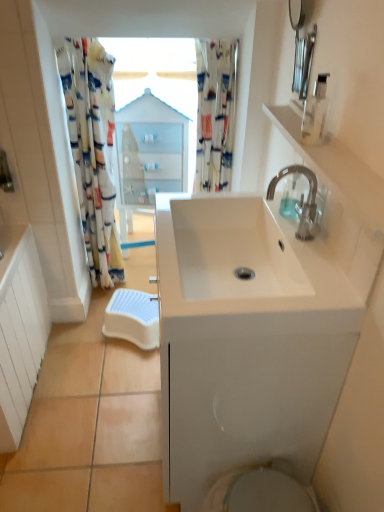
Locate an element on the screen. transparent plastic soap dispenser at upper right, arranged as the 2th soap dispenser when ordered from the bottom is located at coordinates (315, 112).

Find the location of a particular element. silver metallic faucet at upper right is located at coordinates (301, 200).

Measure the distance between point (231,106) and camera.

A distance of 5.96 feet exists between point (231,106) and camera.

The image size is (384, 512). Describe the element at coordinates (248, 268) in the screenshot. I see `white glossy sink at center` at that location.

Where is `floral fabric shower curtain at left, which appears as the second shower curtain when viewed from the right`? The height and width of the screenshot is (512, 384). floral fabric shower curtain at left, which appears as the second shower curtain when viewed from the right is located at coordinates (93, 150).

Image resolution: width=384 pixels, height=512 pixels. What do you see at coordinates (151, 152) in the screenshot?
I see `white glossy cabinet at center` at bounding box center [151, 152].

The width and height of the screenshot is (384, 512). Find the location of `white glossy cabinet at center`. white glossy cabinet at center is located at coordinates (151, 152).

Find the location of a particular element. This screenshot has height=512, width=384. transparent plastic soap dispenser at upper right, arranged as the 2th soap dispenser when ordered from the bottom is located at coordinates (315, 112).

What's the angular difference between white plastic step stool at lower center and clear plastic soap dispenser at upper right, marked as the 1th soap dispenser in a back-to-front arrangement,'s facing directions?

white plastic step stool at lower center and clear plastic soap dispenser at upper right, marked as the 1th soap dispenser in a back-to-front arrangement, are facing 61.8 degrees away from each other.

From the image's perspective, between white plastic step stool at lower center and clear plastic soap dispenser at upper right, positioned as the 1th soap dispenser in bottom-to-top order, who is located below?

white plastic step stool at lower center.

Who is smaller, white plastic step stool at lower center or clear plastic soap dispenser at upper right, marked as the 1th soap dispenser in a back-to-front arrangement?

With smaller size is clear plastic soap dispenser at upper right, marked as the 1th soap dispenser in a back-to-front arrangement.

Looking at this image, is white glossy cabinet at center positioned beyond the bounds of clear plastic soap dispenser at upper right, positioned as the 1th soap dispenser in bottom-to-top order?

white glossy cabinet at center is positioned outside clear plastic soap dispenser at upper right, positioned as the 1th soap dispenser in bottom-to-top order.

Is point (127, 123) positioned after point (284, 189)?

Yes, point (127, 123) is behind point (284, 189).

In the image, is white glossy cabinet at center on the left side or the right side of clear plastic soap dispenser at upper right, marked as the 1th soap dispenser in a back-to-front arrangement?

Clearly, white glossy cabinet at center is on the left of clear plastic soap dispenser at upper right, marked as the 1th soap dispenser in a back-to-front arrangement, in the image.

Image resolution: width=384 pixels, height=512 pixels. I want to click on soap dispenser that appears below the floral fabric shower curtain at left, which appears as the second shower curtain when viewed from the right (from the image's perspective), so click(290, 198).

From the image's perspective, between clear plastic soap dispenser at upper right, the second soap dispenser when ordered from front to back, and floral fabric shower curtain at left, which appears as the second shower curtain when viewed from the right, who is located below?

clear plastic soap dispenser at upper right, the second soap dispenser when ordered from front to back, is shown below in the image.

Are clear plastic soap dispenser at upper right, the second soap dispenser when ordered from front to back, and floral fabric shower curtain at left, which appears as the 1th shower curtain when viewed from the left, far apart?

Yes.

From a real-world perspective, is silver metallic faucet at upper right above or below clear plastic soap dispenser at upper right, positioned as the 1th soap dispenser in bottom-to-top order?

silver metallic faucet at upper right is situated higher than clear plastic soap dispenser at upper right, positioned as the 1th soap dispenser in bottom-to-top order, in the real world.

How many degrees apart are the facing directions of silver metallic faucet at upper right and clear plastic soap dispenser at upper right, marked as the 1th soap dispenser in a back-to-front arrangement?

There is a 0.00917-degree angle between the facing directions of silver metallic faucet at upper right and clear plastic soap dispenser at upper right, marked as the 1th soap dispenser in a back-to-front arrangement.

Considering the relative sizes of silver metallic faucet at upper right and clear plastic soap dispenser at upper right, marked as the 1th soap dispenser in a back-to-front arrangement, in the image provided, is silver metallic faucet at upper right shorter than clear plastic soap dispenser at upper right, marked as the 1th soap dispenser in a back-to-front arrangement,?

No, silver metallic faucet at upper right is not shorter than clear plastic soap dispenser at upper right, marked as the 1th soap dispenser in a back-to-front arrangement.

Is silver metallic faucet at upper right bigger or smaller than clear plastic soap dispenser at upper right, positioned as the 1th soap dispenser in bottom-to-top order?

Clearly, silver metallic faucet at upper right is larger in size than clear plastic soap dispenser at upper right, positioned as the 1th soap dispenser in bottom-to-top order.

Between white glossy sink at center and silver metallic faucet at upper right, which one has more height?

Standing taller between the two is silver metallic faucet at upper right.

The width and height of the screenshot is (384, 512). In order to click on sink lying in front of the silver metallic faucet at upper right in this screenshot , I will do coord(248,268).

From a real-world perspective, is white glossy sink at center physically located above or below silver metallic faucet at upper right?

white glossy sink at center is situated lower than silver metallic faucet at upper right in the real world.

From the image's perspective, does white glossy sink at center appear lower than silver metallic faucet at upper right?

Yes, from the image's perspective, white glossy sink at center is beneath silver metallic faucet at upper right.

Between transparent plastic soap dispenser at upper right, placed as the second soap dispenser when sorted from back to front, and clear plastic soap dispenser at upper right, the second soap dispenser when ordered from front to back, which one has less height?

clear plastic soap dispenser at upper right, the second soap dispenser when ordered from front to back, is shorter.

From the image's perspective, between transparent plastic soap dispenser at upper right, placed as the second soap dispenser when sorted from back to front, and clear plastic soap dispenser at upper right, the second soap dispenser when ordered from front to back, who is located below?

clear plastic soap dispenser at upper right, the second soap dispenser when ordered from front to back.

Is transparent plastic soap dispenser at upper right, the 1th soap dispenser in the front-to-back sequence, wider than clear plastic soap dispenser at upper right, marked as the 1th soap dispenser in a back-to-front arrangement?

Yes.

From a real-world perspective, is transparent plastic soap dispenser at upper right, arranged as the 2th soap dispenser when ordered from the bottom, located higher than clear plastic soap dispenser at upper right, marked as the 1th soap dispenser in a back-to-front arrangement?

Correct, in the physical world, transparent plastic soap dispenser at upper right, arranged as the 2th soap dispenser when ordered from the bottom, is higher than clear plastic soap dispenser at upper right, marked as the 1th soap dispenser in a back-to-front arrangement.

Based on their sizes in the image, would you say white plastic step stool at lower center is bigger or smaller than floral fabric shower curtain at left, which appears as the 1th shower curtain when viewed from the left?

Clearly, white plastic step stool at lower center is smaller in size than floral fabric shower curtain at left, which appears as the 1th shower curtain when viewed from the left.

Consider the image. Is white plastic step stool at lower center facing away from floral fabric shower curtain at left, which appears as the 1th shower curtain when viewed from the left?

No, white plastic step stool at lower center's orientation is not away from floral fabric shower curtain at left, which appears as the 1th shower curtain when viewed from the left.

From the image's perspective, is white plastic step stool at lower center beneath floral fabric shower curtain at left, which appears as the second shower curtain when viewed from the right?

Indeed, from the image's perspective, white plastic step stool at lower center is shown beneath floral fabric shower curtain at left, which appears as the second shower curtain when viewed from the right.

Is floral fabric shower curtain at left, which appears as the 1th shower curtain when viewed from the left, inside white plastic step stool at lower center?

No.

You are a GUI agent. You are given a task and a screenshot of the screen. Output one action in this format:
    pyautogui.click(x=<x>, y=<y>)
    Task: Click on the beach towel below the clear plastic soap dispenser at upper right, positioned as the 1th soap dispenser in bottom-to-top order (from the image's perspective)
    Image resolution: width=384 pixels, height=512 pixels.
    Given the screenshot: What is the action you would take?
    pyautogui.click(x=133, y=318)

This screenshot has height=512, width=384. I want to click on medicine cabinet that appears above the clear plastic soap dispenser at upper right, marked as the 2th soap dispenser in a top-to-bottom arrangement (from the image's perspective), so click(x=151, y=152).

When comparing their distances from clear plastic soap dispenser at upper right, positioned as the 1th soap dispenser in bottom-to-top order, does white glossy cabinet at center or white plastic step stool at lower center seem further?

Among the two, white glossy cabinet at center is located further to clear plastic soap dispenser at upper right, positioned as the 1th soap dispenser in bottom-to-top order.

From the image, which object appears to be nearer to clear plastic soap dispenser at upper right, positioned as the 1th soap dispenser in bottom-to-top order, transparent plastic soap dispenser at upper right, marked as the first soap dispenser in a top-to-bottom arrangement, or floral fabric shower curtain at left, which appears as the 1th shower curtain when viewed from the left?

Among the two, transparent plastic soap dispenser at upper right, marked as the first soap dispenser in a top-to-bottom arrangement, is located nearer to clear plastic soap dispenser at upper right, positioned as the 1th soap dispenser in bottom-to-top order.

From the image, which object appears to be farther from printed fabric shower curtain at upper center, which ranks as the 1th shower curtain in right-to-left order, floral fabric shower curtain at left, which appears as the second shower curtain when viewed from the right, or transparent plastic soap dispenser at upper right, marked as the first soap dispenser in a top-to-bottom arrangement?

transparent plastic soap dispenser at upper right, marked as the first soap dispenser in a top-to-bottom arrangement, is positioned further to the anchor printed fabric shower curtain at upper center, which ranks as the 1th shower curtain in right-to-left order.

Estimate the real-world distances between objects in this image. Which object is further from printed fabric shower curtain at upper center, which ranks as the 1th shower curtain in right-to-left order, white glossy cabinet at center or white plastic step stool at lower center?

white plastic step stool at lower center is further to printed fabric shower curtain at upper center, which ranks as the 1th shower curtain in right-to-left order.

Based on their spatial positions, is white glossy cabinet at center or printed fabric shower curtain at upper center, which ranks as the 1th shower curtain in right-to-left order, closer to floral fabric shower curtain at left, which appears as the second shower curtain when viewed from the right?

white glossy cabinet at center.

Considering their positions, is floral fabric shower curtain at left, which appears as the 1th shower curtain when viewed from the left, positioned closer to white glossy sink at center than printed fabric shower curtain at upper center, which ranks as the 1th shower curtain in right-to-left order?

printed fabric shower curtain at upper center, which ranks as the 1th shower curtain in right-to-left order, lies closer to white glossy sink at center than the other object.

Estimate the real-world distances between objects in this image. Which object is further from clear plastic soap dispenser at upper right, marked as the 1th soap dispenser in a back-to-front arrangement, white plastic step stool at lower center or transparent plastic soap dispenser at upper right, placed as the second soap dispenser when sorted from back to front?

white plastic step stool at lower center.

From the image, which object appears to be farther from white glossy cabinet at center, transparent plastic soap dispenser at upper right, arranged as the 2th soap dispenser when ordered from the bottom, or floral fabric shower curtain at left, which appears as the second shower curtain when viewed from the right?

Based on the image, transparent plastic soap dispenser at upper right, arranged as the 2th soap dispenser when ordered from the bottom, appears to be further to white glossy cabinet at center.

The image size is (384, 512). Find the location of `tap positioned between white glossy sink at center and printed fabric shower curtain at upper center, which ranks as the 1th shower curtain in right-to-left order, from near to far`. tap positioned between white glossy sink at center and printed fabric shower curtain at upper center, which ranks as the 1th shower curtain in right-to-left order, from near to far is located at coordinates (301, 200).

The image size is (384, 512). What are the coordinates of `beach towel between floral fabric shower curtain at left, which appears as the 1th shower curtain when viewed from the left, and clear plastic soap dispenser at upper right, marked as the 2th soap dispenser in a top-to-bottom arrangement, in the horizontal direction` in the screenshot? It's located at (133, 318).

This screenshot has height=512, width=384. Identify the location of tap located between transparent plastic soap dispenser at upper right, marked as the first soap dispenser in a top-to-bottom arrangement, and printed fabric shower curtain at upper center, acting as the 2th shower curtain starting from the left, in the depth direction. (301, 200).

Where is `tap between white glossy sink at center and white glossy cabinet at center in the front-back direction`? Image resolution: width=384 pixels, height=512 pixels. tap between white glossy sink at center and white glossy cabinet at center in the front-back direction is located at coordinates (301, 200).